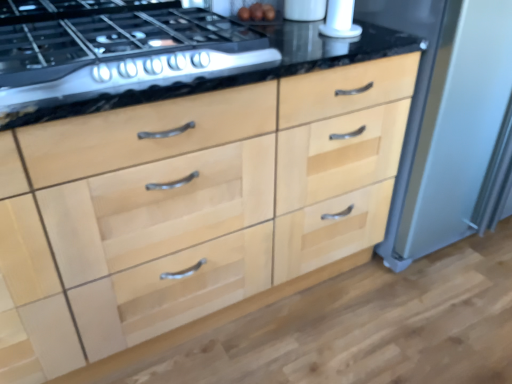
Question: Relative to white glossy salt shaker at upper right, the 1th appliance in the left-to-right sequence, is natural wood drawers at center in front or behind?

Choices:
 (A) behind
 (B) front

Answer: (B)

Question: Would you say natural wood drawers at center is inside or outside white glossy salt shaker at upper right, which is the second appliance from right to left?

Choices:
 (A) outside
 (B) inside

Answer: (A)

Question: Which is nearer to the satin black gas stove at upper left?

Choices:
 (A) satin silver refrigerator at right, which is the 2th appliance in left-to-right order
 (B) white glossy salt shaker at upper right, the 1th appliance in the left-to-right sequence
 (C) natural wood drawers at center

Answer: (C)

Question: Which object is the closest to the satin black gas stove at upper left?

Choices:
 (A) satin silver refrigerator at right, which is the 2th appliance in left-to-right order
 (B) white glossy salt shaker at upper right, the 1th appliance in the left-to-right sequence
 (C) natural wood drawers at center

Answer: (C)